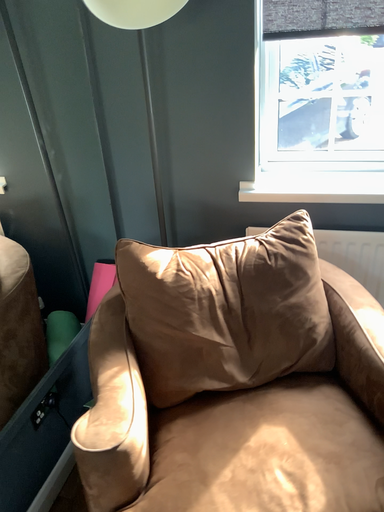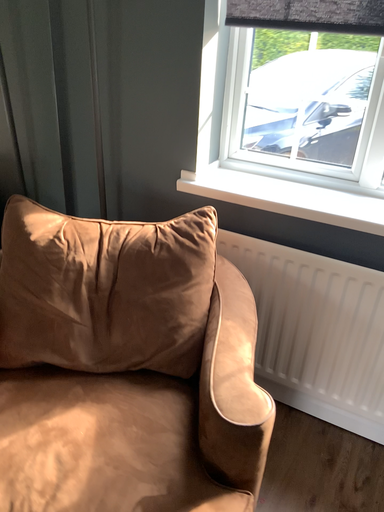
Question: How did the camera likely rotate when shooting the video?

Choices:
 (A) rotated left
 (B) rotated right

Answer: (A)